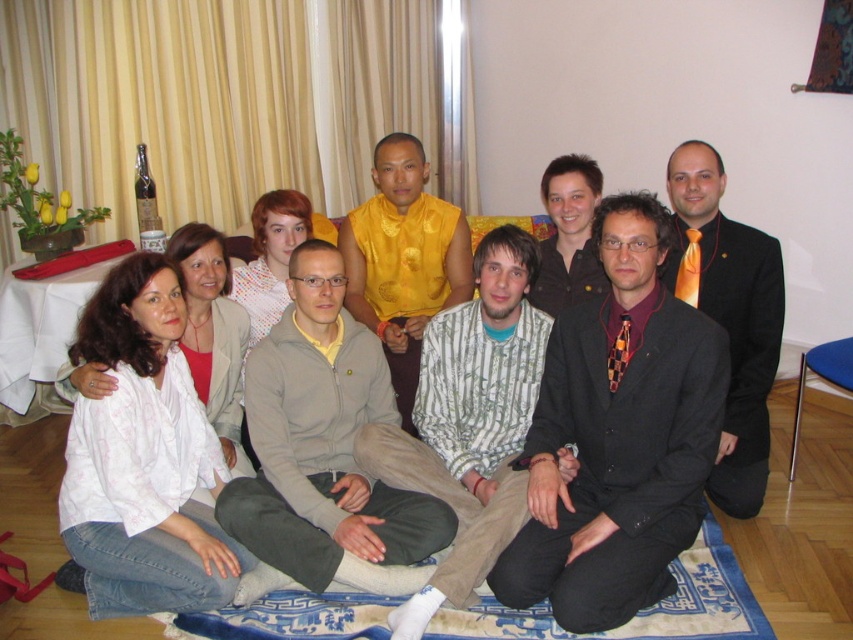
Question: Does white cotton shirt at lower left have a smaller size compared to shiny yellow vest at center?

Choices:
 (A) no
 (B) yes

Answer: (A)

Question: Estimate the real-world distances between objects in this image. Which object is farther from the striped cotton shirt at center?

Choices:
 (A) blue woven mat at lower center
 (B) light gray fleece jacket at center

Answer: (A)

Question: Can you confirm if striped cotton shirt at center is thinner than matte black suit at center?

Choices:
 (A) no
 (B) yes

Answer: (A)

Question: Which of these objects is positioned farthest from the light gray fleece jacket at center?

Choices:
 (A) blue woven mat at lower center
 (B) matte black suit at center

Answer: (B)

Question: Observing the image, what is the correct spatial positioning of white cotton shirt at lower left in reference to shiny yellow vest at center?

Choices:
 (A) right
 (B) left

Answer: (A)

Question: Based on their relative distances, which object is farther from the black suit at center?

Choices:
 (A) striped cotton shirt at center
 (B) blue woven mat at lower center
 (C) light gray fleece jacket at center
 (D) shiny yellow vest at center

Answer: (D)